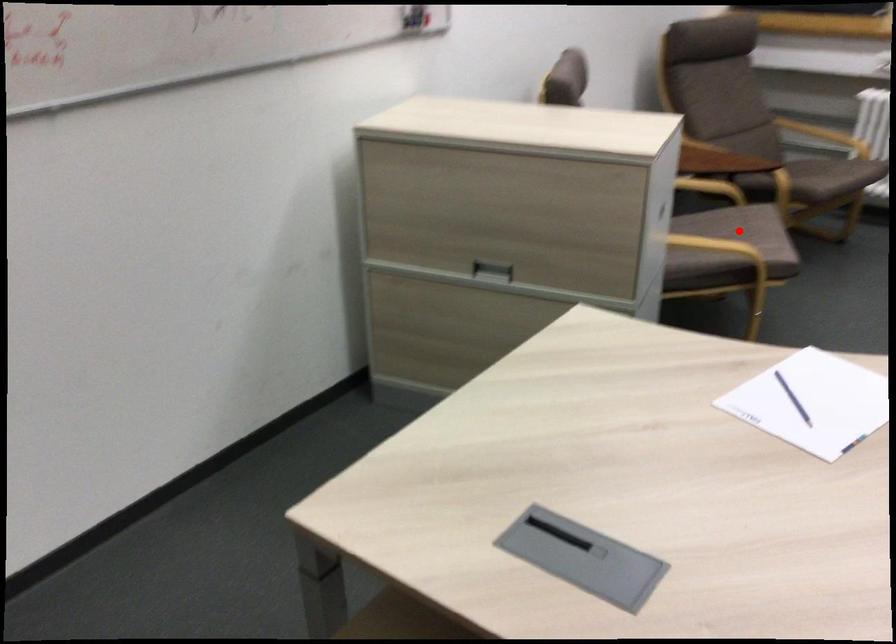
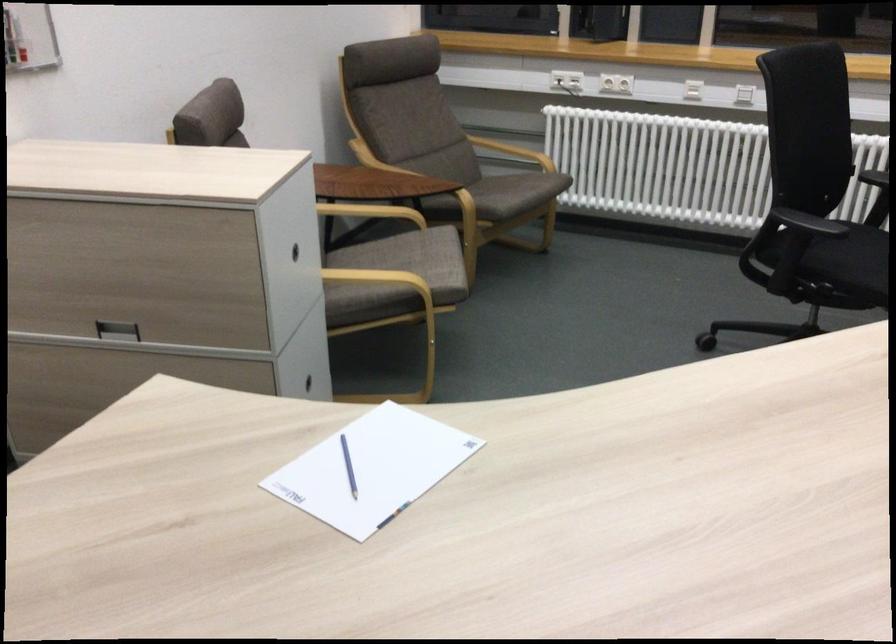
Where in the second image is the point corresponding to the highlighted location from the first image?

(412, 259)